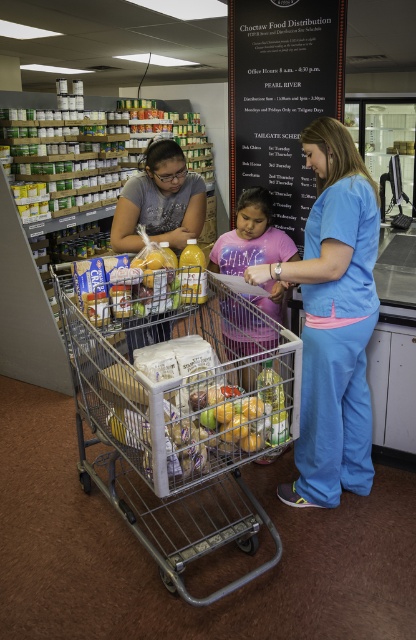
Question: From the image, what is the correct spatial relationship of blue scrubs at center in relation to matte gray shirt at center?

Choices:
 (A) above
 (B) below

Answer: (B)

Question: Can you confirm if blue scrubs at center is wider than pink cotton shirt at center?

Choices:
 (A) no
 (B) yes

Answer: (B)

Question: Which of the following is the farthest from the observer?

Choices:
 (A) matte gray shirt at center
 (B) pink cotton shirt at center
 (C) blue scrubs at center
 (D) metallic silver trolley at center

Answer: (B)

Question: Estimate the real-world distances between objects in this image. Which object is closer to the matte plastic bag of chips at center?

Choices:
 (A) pink cotton shirt at center
 (B) matte gray shirt at center
 (C) blue scrubs at center
 (D) metallic silver trolley at center

Answer: (D)

Question: Considering the real-world distances, which object is farthest from the matte plastic bag of chips at center?

Choices:
 (A) matte gray shirt at center
 (B) metallic silver trolley at center

Answer: (A)

Question: Is blue scrubs at center above matte gray shirt at center?

Choices:
 (A) yes
 (B) no

Answer: (B)